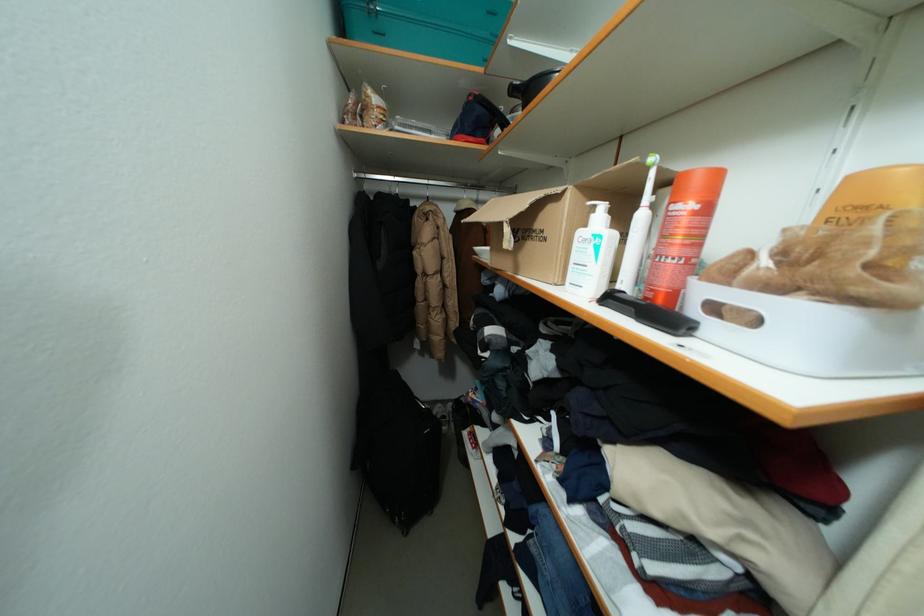
At what (x,y) coordinates should I click in order to perform the action: click on white tray handle. Please return your answer as a coordinate pair (x, y). The width and height of the screenshot is (924, 616). Looking at the image, I should click on (810, 333).